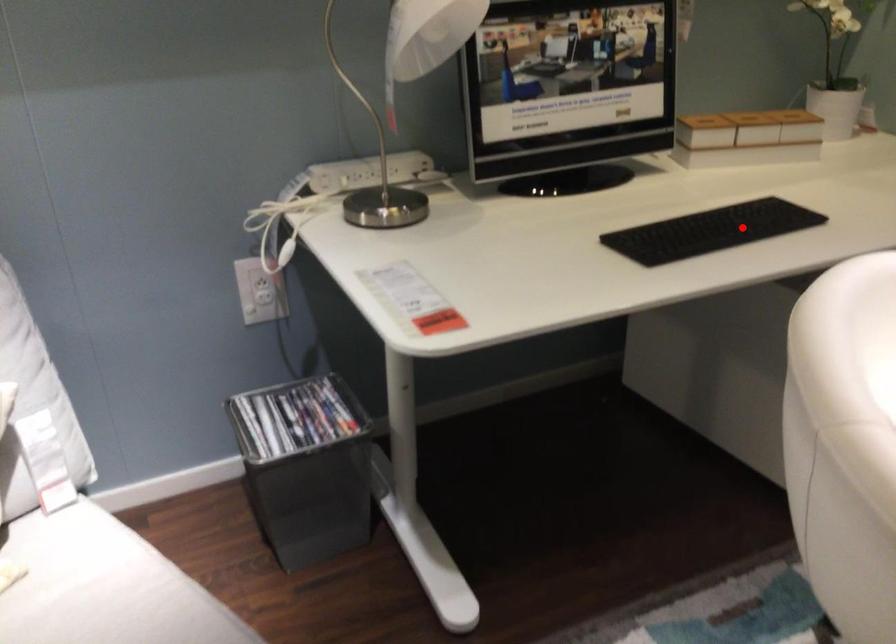
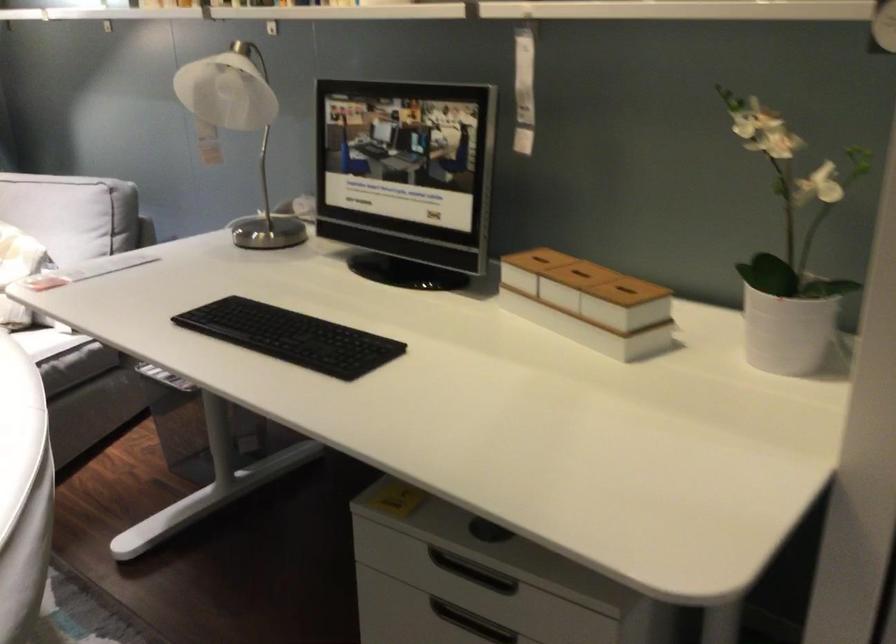
Locate, in the second image, the point that corresponds to the highlighted location in the first image.

(291, 337)